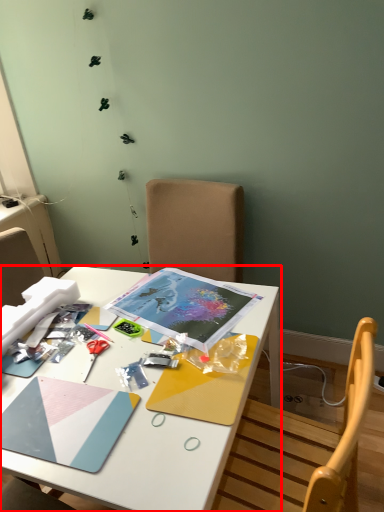
Question: In this image, where is desk (annotated by the red box) located relative to scissors?

Choices:
 (A) right
 (B) left

Answer: (A)